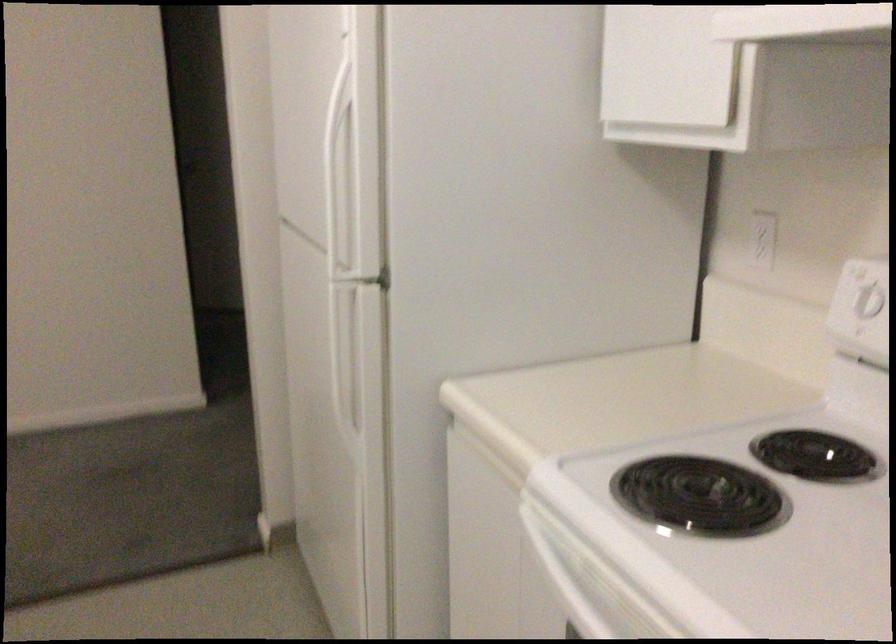
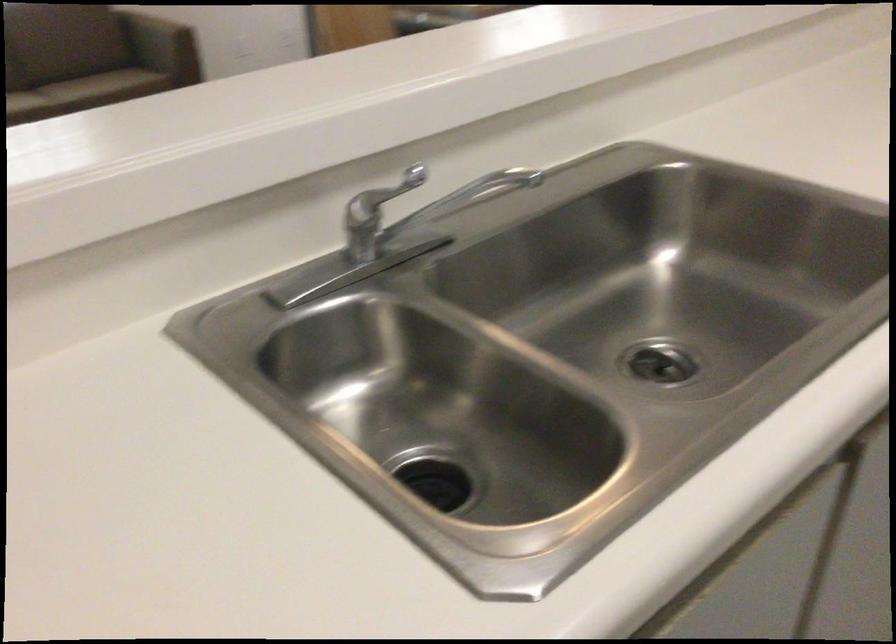
Based on the continuous images, in which direction is the camera rotating?

The camera rotated toward left-down.